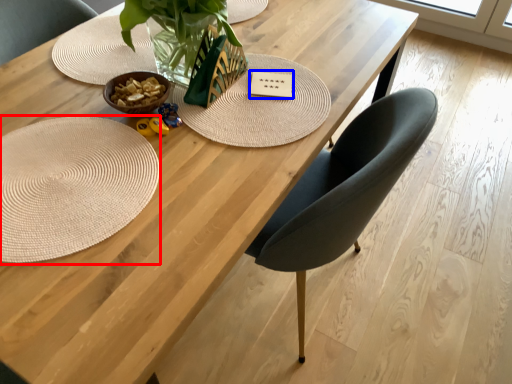
Question: Which point is closer to the camera, mat (highlighted by a red box) or card (highlighted by a blue box)?

Choices:
 (A) mat
 (B) card

Answer: (A)